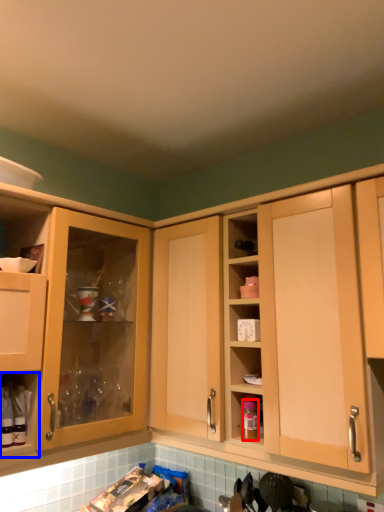
Question: Among these objects, which one is farthest to the camera, bottle (highlighted by a red box) or cabinet (highlighted by a blue box)?

Choices:
 (A) bottle
 (B) cabinet

Answer: (A)